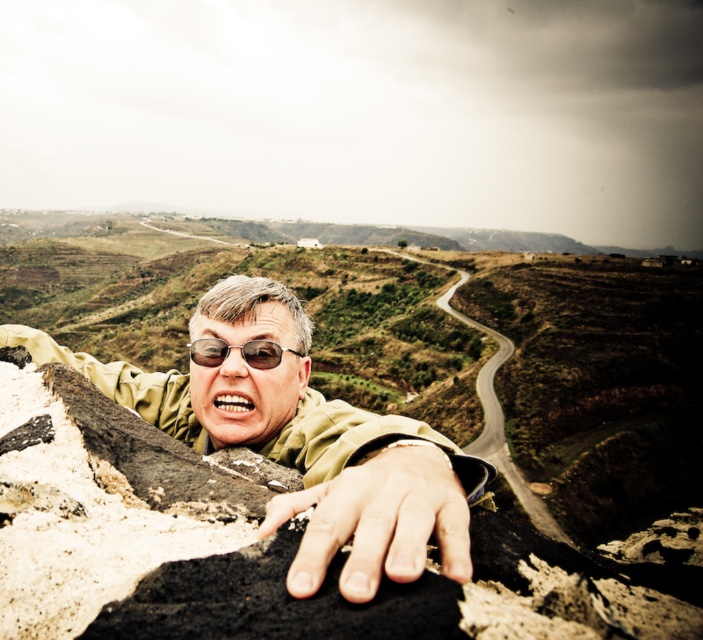
Does smooth stone hand at center appear on the right side of sunglasses at center?

Indeed, smooth stone hand at center is positioned on the right side of sunglasses at center.

Which is below, smooth stone hand at center or sunglasses at center?

smooth stone hand at center

Who is more distant from viewer, (361, 541) or (245, 349)?

Positioned behind is point (245, 349).

The image size is (703, 640). I want to click on smooth stone hand at center, so click(x=378, y=522).

Can you confirm if matte green jacket at center is positioned above smooth stone hand at center?

Indeed, matte green jacket at center is positioned over smooth stone hand at center.

Which is above, matte green jacket at center or smooth stone hand at center?

matte green jacket at center is higher up.

Describe the element at coordinates (302, 442) in the screenshot. Image resolution: width=703 pixels, height=640 pixels. I see `matte green jacket at center` at that location.

Locate an element on the screen. The width and height of the screenshot is (703, 640). matte green jacket at center is located at coordinates (302, 442).

Is matte green jacket at center wider than sunglasses at center?

Correct, the width of matte green jacket at center exceeds that of sunglasses at center.

Between matte green jacket at center and sunglasses at center, which one appears on the right side from the viewer's perspective?

matte green jacket at center is more to the right.

Which is in front, point (188, 426) or point (207, 362)?

Positioned in front is point (207, 362).

Where is `matte green jacket at center`? Image resolution: width=703 pixels, height=640 pixels. matte green jacket at center is located at coordinates (302, 442).